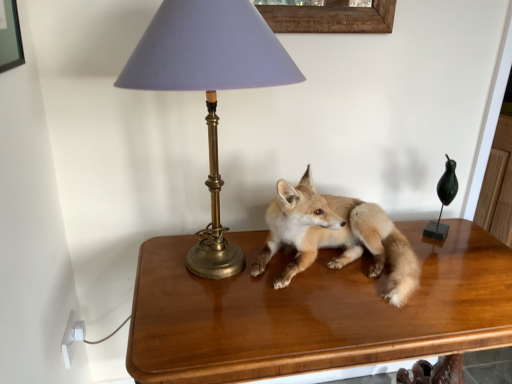
Find the location of `free space below matte gold lamp at upper left (from a real-world perspective)`. free space below matte gold lamp at upper left (from a real-world perspective) is located at coordinates (196, 280).